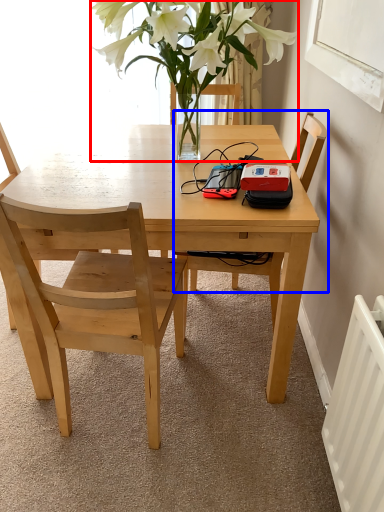
Question: Which object is closer to the camera taking this photo, houseplant (highlighted by a red box) or chair (highlighted by a blue box)?

Choices:
 (A) houseplant
 (B) chair

Answer: (A)